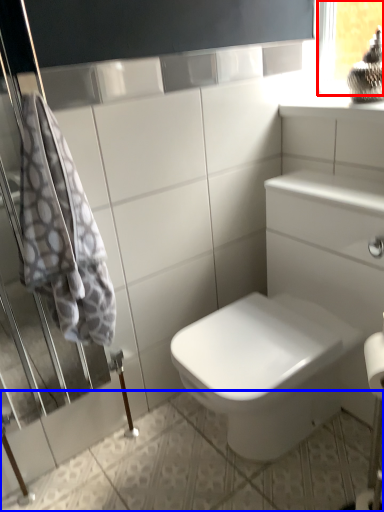
Question: Among these objects, which one is nearest to the camera, window frame (highlighted by a red box) or ceramic tile (highlighted by a blue box)?

Choices:
 (A) window frame
 (B) ceramic tile

Answer: (B)